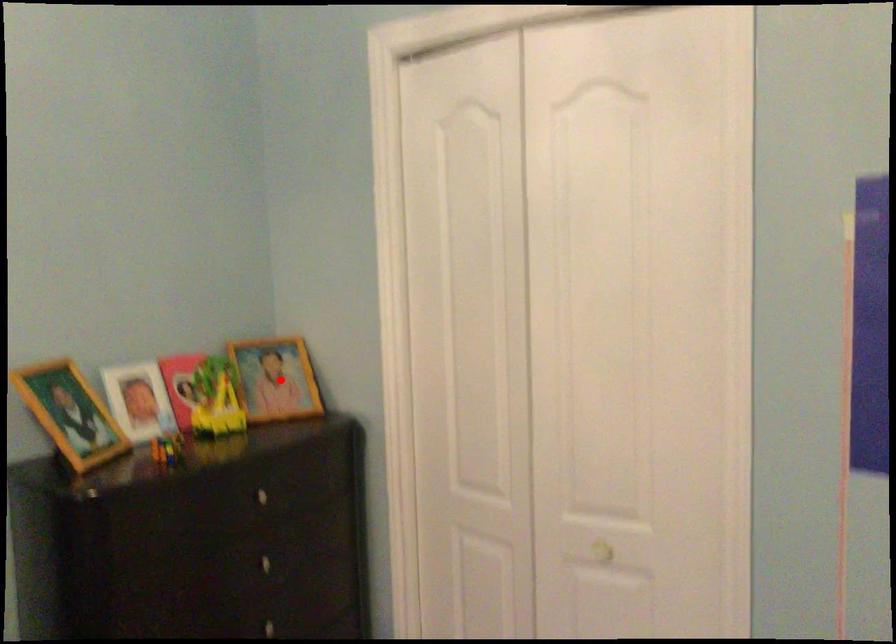
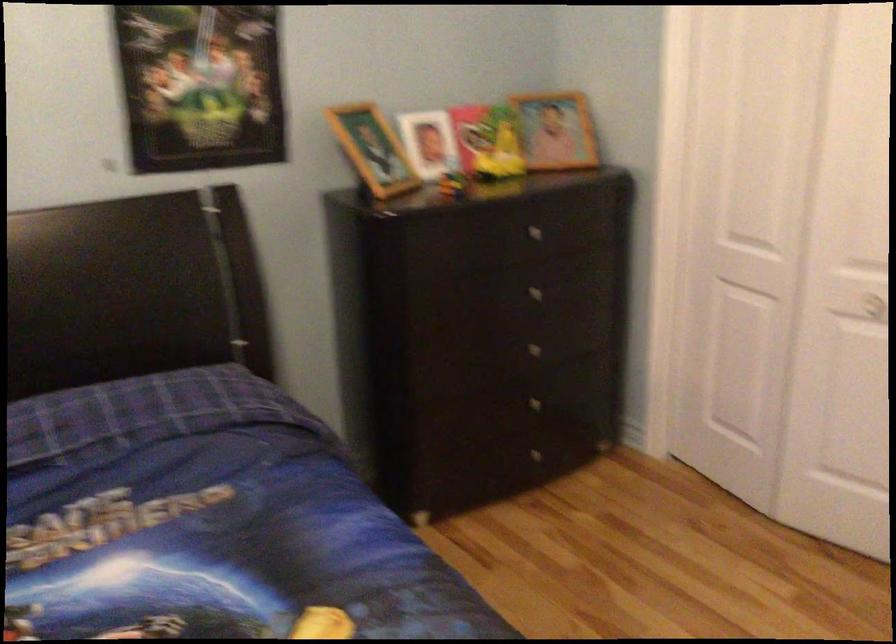
In the second image, find the point that corresponds to the highlighted location in the first image.

(556, 129)